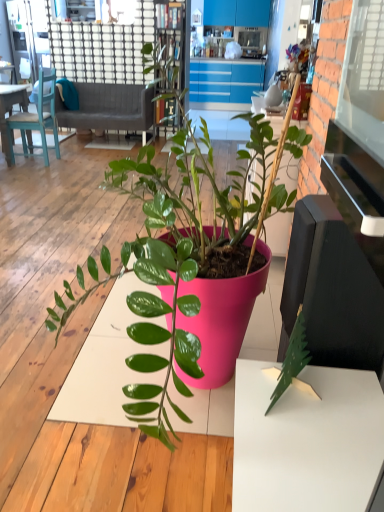
Question: Should I look upward or downward to see wooden bookshelf at upper center?

Choices:
 (A) down
 (B) up

Answer: (B)

Question: From a real-world perspective, is matte plastic figurine at upper center positioned over gray fabric couch at upper left based on gravity?

Choices:
 (A) no
 (B) yes

Answer: (B)

Question: Is the depth of matte plastic figurine at upper center less than that of gray fabric couch at upper left?

Choices:
 (A) yes
 (B) no

Answer: (B)

Question: Does matte plastic figurine at upper center have a greater height compared to gray fabric couch at upper left?

Choices:
 (A) no
 (B) yes

Answer: (A)

Question: Considering the relative sizes of matte plastic figurine at upper center and gray fabric couch at upper left in the image provided, is matte plastic figurine at upper center thinner than gray fabric couch at upper left?

Choices:
 (A) yes
 (B) no

Answer: (A)

Question: Is matte plastic figurine at upper center turned away from gray fabric couch at upper left?

Choices:
 (A) yes
 (B) no

Answer: (B)

Question: Can you confirm if matte plastic figurine at upper center is smaller than gray fabric couch at upper left?

Choices:
 (A) yes
 (B) no

Answer: (A)

Question: Considering the relative positions of teal wooden chair at upper left and matte plastic figurine at upper center in the image provided, is teal wooden chair at upper left to the left of matte plastic figurine at upper center from the viewer's perspective?

Choices:
 (A) no
 (B) yes

Answer: (B)

Question: Is teal wooden chair at upper left shorter than matte plastic figurine at upper center?

Choices:
 (A) yes
 (B) no

Answer: (B)

Question: Can you confirm if teal wooden chair at upper left is taller than matte plastic figurine at upper center?

Choices:
 (A) yes
 (B) no

Answer: (A)

Question: Are teal wooden chair at upper left and matte plastic figurine at upper center located far from each other?

Choices:
 (A) yes
 (B) no

Answer: (A)

Question: From the image's perspective, would you say teal wooden chair at upper left is positioned over matte plastic figurine at upper center?

Choices:
 (A) no
 (B) yes

Answer: (A)

Question: Is teal wooden chair at upper left outside of matte plastic figurine at upper center?

Choices:
 (A) no
 (B) yes

Answer: (B)

Question: Is gray fabric couch at upper left outside of matte plastic figurine at upper center?

Choices:
 (A) no
 (B) yes

Answer: (B)